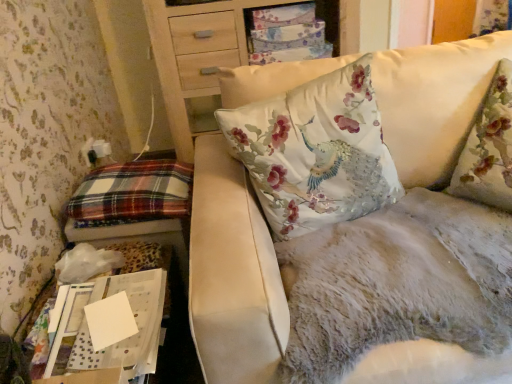
The width and height of the screenshot is (512, 384). Describe the element at coordinates (232, 274) in the screenshot. I see `fluffy white couch at upper right` at that location.

Where is `fluffy white couch at upper right`? fluffy white couch at upper right is located at coordinates (232, 274).

How different are the orientations of fluffy white couch at upper right and plaid fabric pillow at left in degrees?

The angular difference between fluffy white couch at upper right and plaid fabric pillow at left is 87.6 degrees.

Considering the sizes of objects fluffy white couch at upper right and plaid fabric pillow at left in the image provided, who is taller, fluffy white couch at upper right or plaid fabric pillow at left?

fluffy white couch at upper right.

Who is more distant, fluffy white couch at upper right or plaid fabric pillow at left?

plaid fabric pillow at left.

Between fluffy white couch at upper right and plaid fabric pillow at left, which one appears on the left side from the viewer's perspective?

From the viewer's perspective, plaid fabric pillow at left appears more on the left side.

Does point (95, 220) appear closer or farther from the camera than point (223, 3)?

Point (95, 220) is positioned closer to the camera compared to point (223, 3).

Is the position of plaid fabric pillow at left more distant than that of floral fabric cushion at upper center?

No, the depth of plaid fabric pillow at left is less than that of floral fabric cushion at upper center.

From the image's perspective, which one is positioned lower, plaid fabric pillow at left or floral fabric cushion at upper center?

plaid fabric pillow at left, from the image's perspective.

Is point (224, 188) farther from viewer compared to point (338, 6)?

No, it is not.

Considering their positions, is fluffy white couch at upper right located in front of or behind floral fabric cushion at upper center?

Clearly, fluffy white couch at upper right is in front of floral fabric cushion at upper center.

How much distance is there between fluffy white couch at upper right and floral fabric cushion at upper center?

The distance of fluffy white couch at upper right from floral fabric cushion at upper center is 34.97 inches.

How many degrees apart are the facing directions of fluffy white couch at upper right and floral fabric cushion at upper center?

fluffy white couch at upper right and floral fabric cushion at upper center are facing 2.59 degrees away from each other.

Considering the relative sizes of plaid fabric pillow at left and white paper at lower left in the image provided, is plaid fabric pillow at left smaller than white paper at lower left?

No, plaid fabric pillow at left is not smaller than white paper at lower left.

How distant is plaid fabric pillow at left from white paper at lower left?

They are 47.27 centimeters apart.

Is plaid fabric pillow at left to the left of white paper at lower left from the viewer's perspective?

Correct, you'll find plaid fabric pillow at left to the left of white paper at lower left.

From the image's perspective, is plaid fabric pillow at left located above or below white paper at lower left?

plaid fabric pillow at left is situated higher than white paper at lower left in the image.

Is white paper at lower left facing towards plaid fabric pillow at left?

No, white paper at lower left is not aimed at plaid fabric pillow at left.

Looking at this image, is white paper at lower left positioned before plaid fabric pillow at left?

Yes, the depth of white paper at lower left is less than that of plaid fabric pillow at left.

In the scene shown: Is white paper at lower left to the left or to the right of plaid fabric pillow at left in the image?

white paper at lower left is positioned on plaid fabric pillow at left's right side.

In the scene shown: Is white paper at lower left taller or shorter than plaid fabric pillow at left?

white paper at lower left is shorter than plaid fabric pillow at left.

Is floral fabric cushion at upper center to the right of white paper at lower left from the viewer's perspective?

Yes, floral fabric cushion at upper center is to the right of white paper at lower left.

Is floral fabric cushion at upper center positioned far away from white paper at lower left?

floral fabric cushion at upper center is positioned a significant distance from white paper at lower left.

Is floral fabric cushion at upper center bigger than white paper at lower left?

Correct, floral fabric cushion at upper center is larger in size than white paper at lower left.

How different are the orientations of floral fabric cushion at upper center and white paper at lower left in degrees?

floral fabric cushion at upper center and white paper at lower left are facing 90.2 degrees away from each other.

Which object is closer to the camera taking this photo, white paper at lower left or floral fabric cushion at upper center?

white paper at lower left is closer to the camera.

Considering the sizes of objects white paper at lower left and floral fabric cushion at upper center in the image provided, who is shorter, white paper at lower left or floral fabric cushion at upper center?

Standing shorter between the two is white paper at lower left.

Are white paper at lower left and floral fabric cushion at upper center far apart?

Yes, white paper at lower left and floral fabric cushion at upper center are located far from each other.

Is white paper at lower left wider or thinner than floral fabric cushion at upper center?

In the image, white paper at lower left appears to be more narrow than floral fabric cushion at upper center.

Locate an element on the screen. The image size is (512, 384). studio couch that is in front of the plaid fabric pillow at left is located at coordinates (232, 274).

This screenshot has height=384, width=512. In order to click on pillow located underneath the floral fabric cushion at upper center (from a real-world perspective) in this screenshot , I will do `click(132, 193)`.

From the image, which object appears to be nearer to plaid fabric pillow at left, fluffy white couch at upper right or white paper at lower left?

fluffy white couch at upper right.

Which object lies nearer to the anchor point white paper at lower left, fluffy white couch at upper right or floral fabric cushion at upper center?

The object closer to white paper at lower left is fluffy white couch at upper right.

From the image, which object appears to be farther from fluffy white couch at upper right, floral fabric cushion at upper center or white paper at lower left?

floral fabric cushion at upper center is further to fluffy white couch at upper right.

Looking at the image, which one is located closer to white paper at lower left, floral fabric cushion at upper center or fluffy white couch at upper right?

Among the two, fluffy white couch at upper right is located nearer to white paper at lower left.

When comparing their distances from floral fabric cushion at upper center, does white paper at lower left or plaid fabric pillow at left seem closer?

plaid fabric pillow at left lies closer to floral fabric cushion at upper center than the other object.

Based on their spatial positions, is fluffy white couch at upper right or plaid fabric pillow at left closer to white paper at lower left?

Among the two, fluffy white couch at upper right is located nearer to white paper at lower left.

From the image, which object appears to be nearer to floral fabric cushion at upper center, plaid fabric pillow at left or white paper at lower left?

Based on the image, plaid fabric pillow at left appears to be nearer to floral fabric cushion at upper center.

Considering their positions, is floral fabric cushion at upper center positioned closer to white paper at lower left than plaid fabric pillow at left?

plaid fabric pillow at left is positioned closer to the anchor white paper at lower left.

You are a GUI agent. You are given a task and a screenshot of the screen. Output one action in this format:
    pyautogui.click(x=<x>, y=<y>)
    Task: Click on the pillow positioned between fluffy white couch at upper right and floral fabric cushion at upper center from near to far
    This screenshot has width=512, height=384.
    Given the screenshot: What is the action you would take?
    pyautogui.click(x=132, y=193)

At what (x,y) coordinates should I click in order to perform the action: click on cardboard box between plaid fabric pillow at left and fluffy white couch at upper right. Please return your answer as a coordinate pair (x, y). Looking at the image, I should click on (117, 342).

Identify the location of cardboard box between fluffy white couch at upper right and floral fabric cushion at upper center from front to back. (117, 342).

The image size is (512, 384). Identify the location of pillow positioned between white paper at lower left and floral fabric cushion at upper center from near to far. (132, 193).